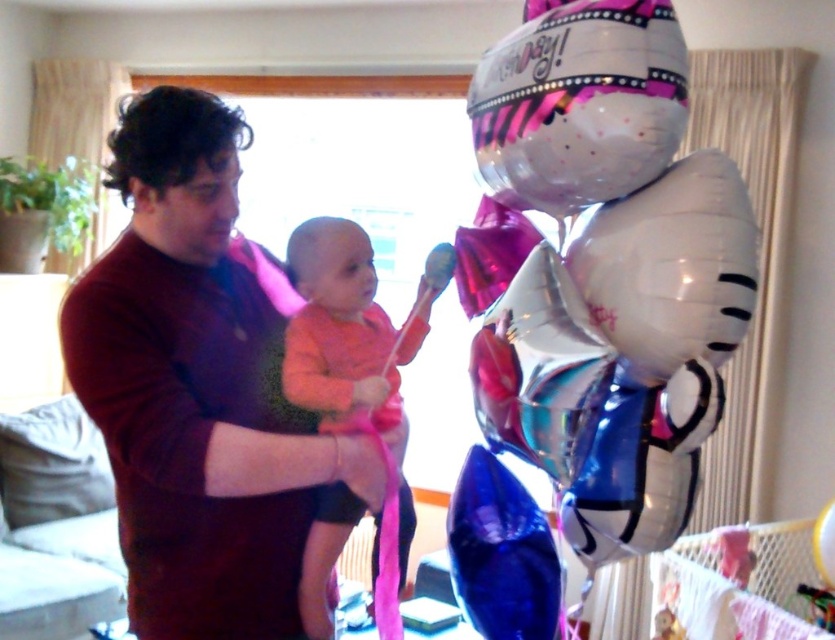
You are a photographer trying to capture a photo of the metallic silver balloons at right and the matte dark red shirt at center. Based on their positions, which object would appear larger in the photo?

The metallic silver balloons at right is taller than the matte dark red shirt at center, so it would appear larger in the photo.